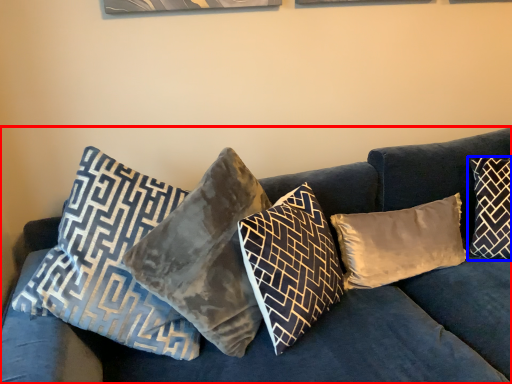
Question: Which object is closer to the camera taking this photo, studio couch (highlighted by a red box) or pillow (highlighted by a blue box)?

Choices:
 (A) studio couch
 (B) pillow

Answer: (A)